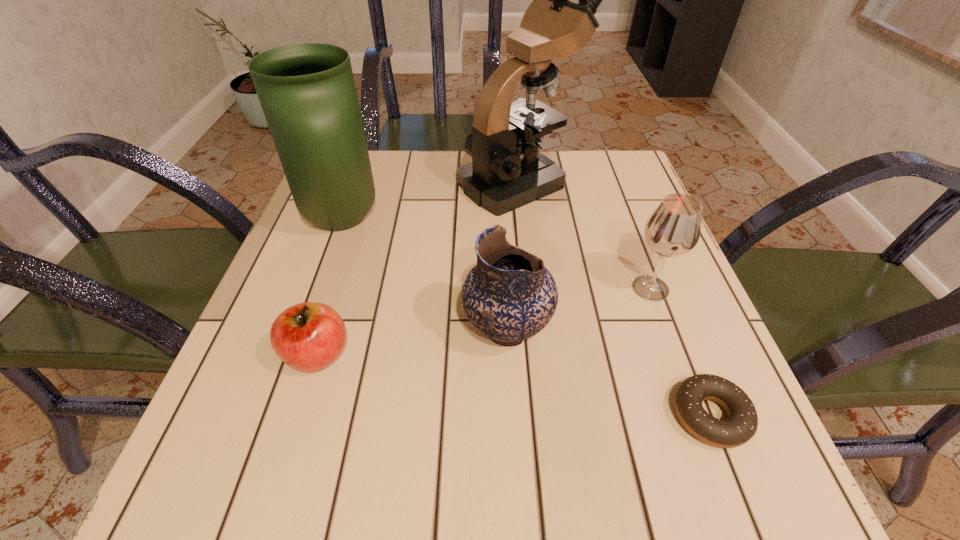
This screenshot has width=960, height=540. I want to click on vacant area in the image that satisfies the following two spatial constraints: 1. on the back side of the wineglass; 2. on the left side of the fifth tallest object, so pyautogui.click(x=338, y=288).

Identify the location of vacant position in the image that satisfies the following two spatial constraints: 1. on the front side of the wineglass; 2. on the right side of the vase. (319, 288).

What are the coordinates of `vacant region that satisfies the following two spatial constraints: 1. on the back side of the microscope; 2. on the left side of the apple` in the screenshot? It's located at (371, 183).